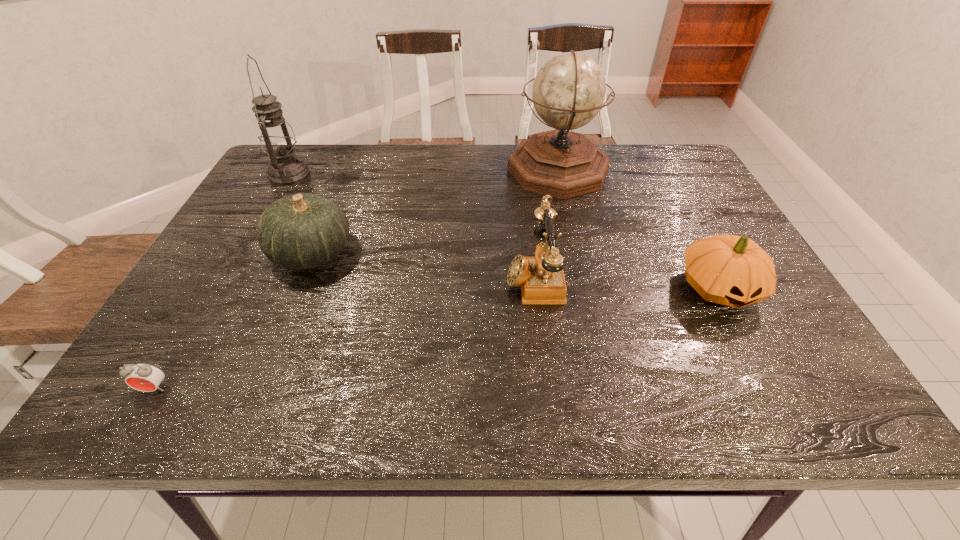
Where is `empty space that is in between the nearest object and the third object from left to right`? Image resolution: width=960 pixels, height=540 pixels. empty space that is in between the nearest object and the third object from left to right is located at coordinates (233, 321).

Where is `blank region between the globe and the rightmost object`? blank region between the globe and the rightmost object is located at coordinates (638, 229).

At what (x,y) coordinates should I click in order to perform the action: click on vacant area that lies between the alarm clock and the telephone. Please return your answer as a coordinate pair (x, y). The image size is (960, 540). Looking at the image, I should click on (345, 332).

The height and width of the screenshot is (540, 960). Find the location of `free space between the shortest object and the right gourd`. free space between the shortest object and the right gourd is located at coordinates (437, 338).

Locate an element on the screen. vacant space that's between the alarm clock and the telephone is located at coordinates (345, 332).

At what (x,y) coordinates should I click in order to perform the action: click on free spot between the telephone and the oil lamp. Please return your answer as a coordinate pair (x, y). Looking at the image, I should click on (412, 225).

You are a GUI agent. You are given a task and a screenshot of the screen. Output one action in this format:
    pyautogui.click(x=<x>, y=<y>)
    Task: Click on the third closest object to the telephone
    
    Given the screenshot: What is the action you would take?
    pyautogui.click(x=301, y=231)

I want to click on object that ranks as the closest to the nearest object, so click(301, 231).

The image size is (960, 540). I want to click on free space that satisfies the following two spatial constraints: 1. on the front side of the oil lamp; 2. on the left side of the left gourd, so click(243, 253).

Find the location of a particular element. The image size is (960, 540). blank area in the image that satisfies the following two spatial constraints: 1. on the surface of the globe; 2. on the face of the alarm clock is located at coordinates (609, 388).